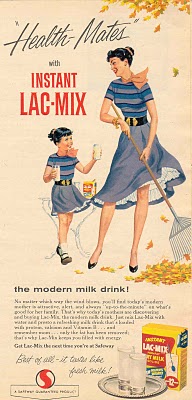
Where is `tray`? The width and height of the screenshot is (192, 400). tray is located at coordinates (111, 390).